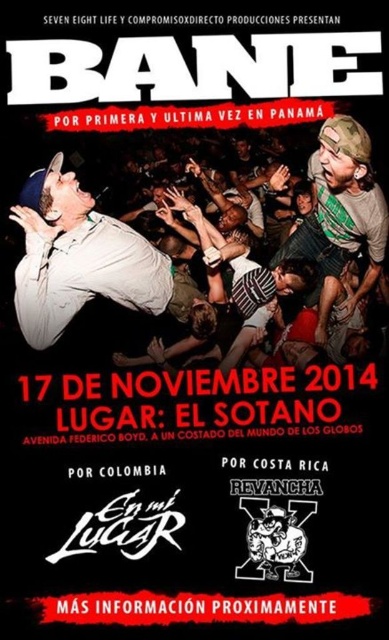
Question: Which object is closer to the camera taking this photo?

Choices:
 (A) matte white shirt at upper left
 (B) white matte shirt at center

Answer: (A)

Question: Which point is closer to the camera?

Choices:
 (A) (331, 132)
 (B) (134, 232)

Answer: (A)

Question: Is matte white shirt at upper left bigger than white matte shirt at center?

Choices:
 (A) yes
 (B) no

Answer: (A)

Question: Does matte white shirt at upper left have a greater width compared to white matte shirt at center?

Choices:
 (A) yes
 (B) no

Answer: (A)

Question: Which of the following is the closest to the observer?

Choices:
 (A) (92, 237)
 (B) (54, 332)

Answer: (B)

Question: Is matte white shirt at upper left thinner than white matte shirt at center?

Choices:
 (A) no
 (B) yes

Answer: (A)